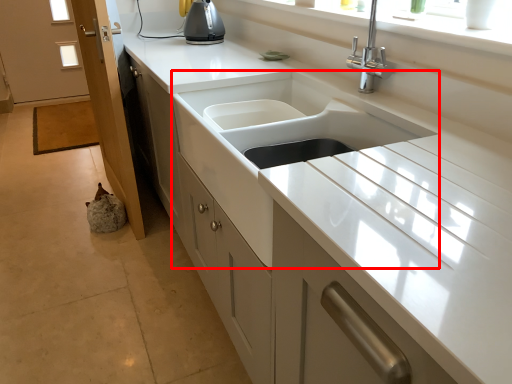
Question: From the image's perspective, where is sink (annotated by the red box) located relative to screen door?

Choices:
 (A) below
 (B) above

Answer: (A)